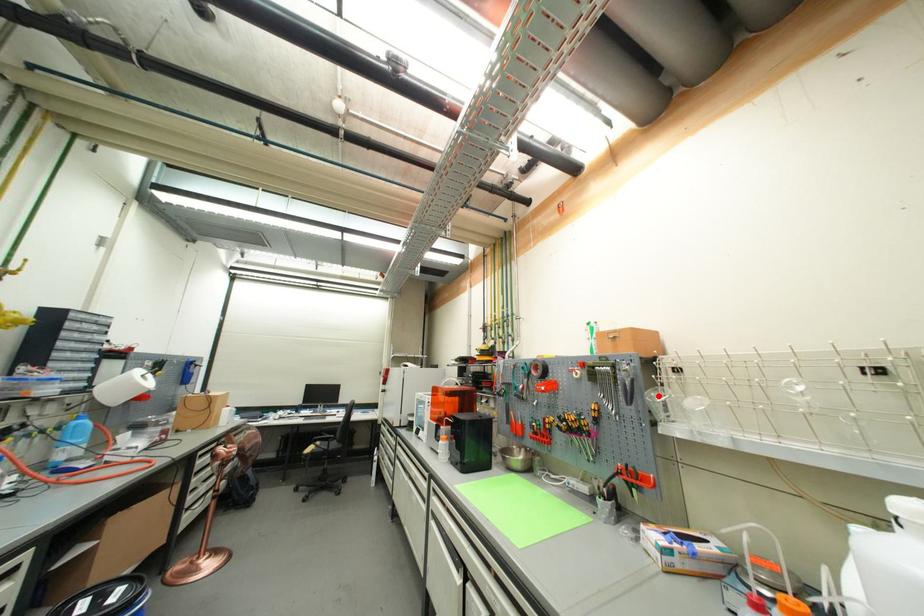
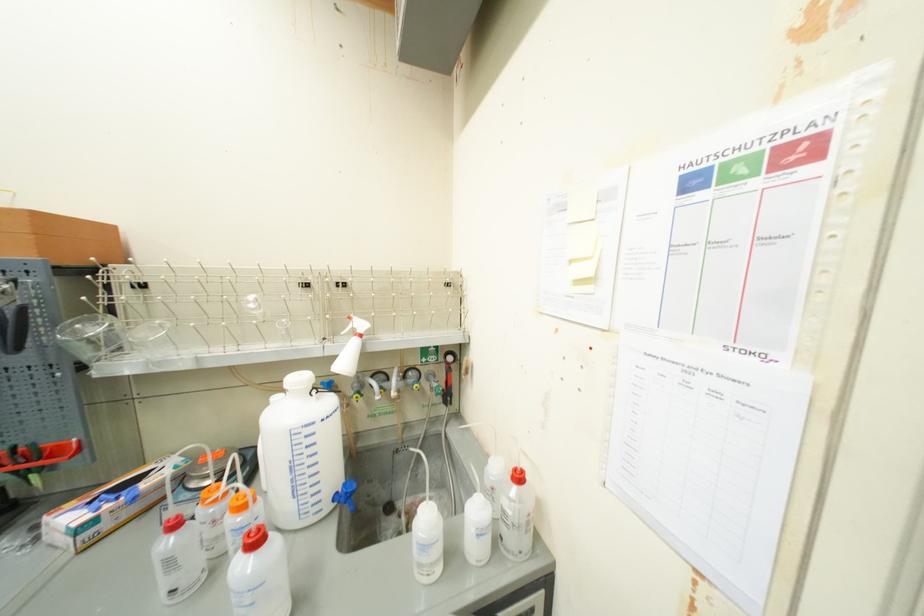
In the second image, find the point that corresponds to the highlighted location in the first image.

(83, 328)